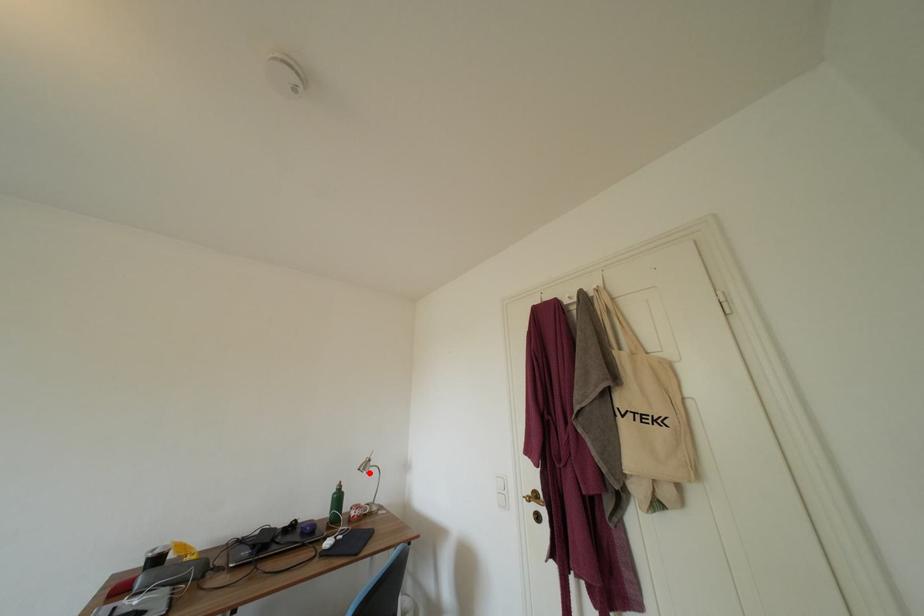
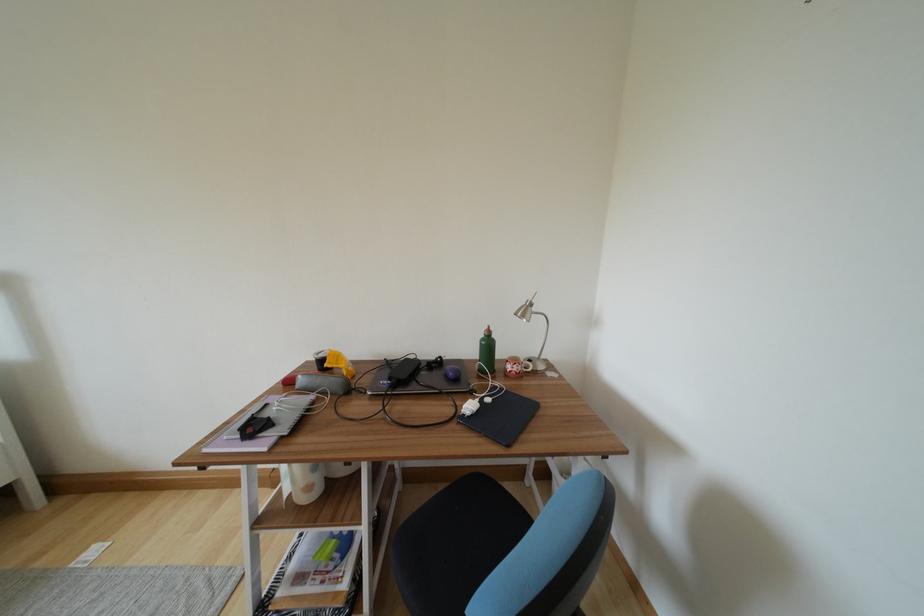
The point at the highlighted location is marked in the first image. Where is the corresponding point in the second image?

(528, 320)